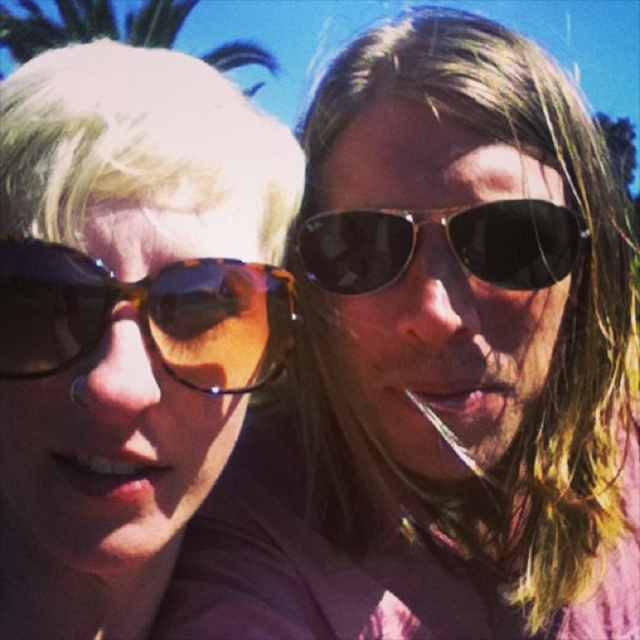
Question: Can you confirm if matte tortoiseshell sunglasses at left is positioned to the left of green leafy palm tree at upper left?

Choices:
 (A) no
 (B) yes

Answer: (A)

Question: Considering the relative positions of black reflective sunglasses at center and green leafy palm tree at upper left in the image provided, where is black reflective sunglasses at center located with respect to green leafy palm tree at upper left?

Choices:
 (A) below
 (B) above

Answer: (A)

Question: Where is matte tortoiseshell sunglasses at left located in relation to black reflective sunglasses at center in the image?

Choices:
 (A) below
 (B) above

Answer: (A)

Question: Which of the following is the farthest from the observer?

Choices:
 (A) (180, 397)
 (B) (324, 278)
 (C) (129, 12)

Answer: (C)

Question: Among these objects, which one is nearest to the camera?

Choices:
 (A) matte tortoiseshell sunglasses at left
 (B) tortoiseshell sunglasses at left
 (C) green leafy palm tree at upper left

Answer: (A)

Question: Estimate the real-world distances between objects in this image. Which object is closer to the matte tortoiseshell sunglasses at left?

Choices:
 (A) green leafy palm tree at upper left
 (B) tortoiseshell sunglasses at left
 (C) black reflective sunglasses at center

Answer: (B)